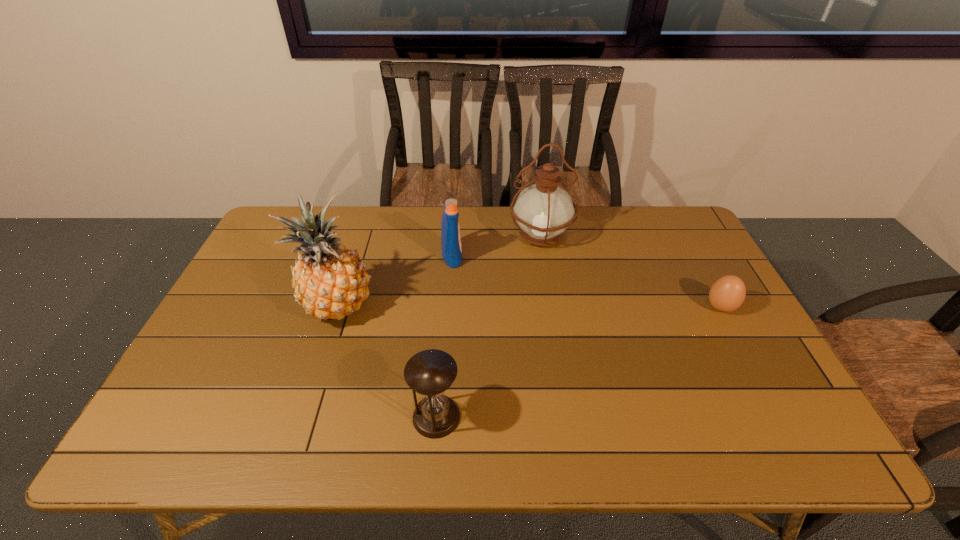
Locate an element on the screen. This screenshot has height=540, width=960. the fourth object from left to right is located at coordinates (543, 211).

Where is `pineapple`? This screenshot has height=540, width=960. pineapple is located at coordinates 330,281.

Where is `the third tallest object`? The width and height of the screenshot is (960, 540). the third tallest object is located at coordinates [451, 248].

You are a GUI agent. You are given a task and a screenshot of the screen. Output one action in this format:
    pyautogui.click(x=<x>, y=<y>)
    Task: Click on the hourglass
    This screenshot has width=960, height=540.
    Given the screenshot: What is the action you would take?
    (431, 372)

Image resolution: width=960 pixels, height=540 pixels. I want to click on the fourth tallest object, so click(431, 372).

Identify the location of the shortest object. This screenshot has height=540, width=960. (728, 293).

Locate an element on the screen. the rightmost object is located at coordinates (728, 293).

Locate an element on the screen. The width and height of the screenshot is (960, 540). vacant space located on the right of the oil lamp is located at coordinates (659, 235).

Where is `vacant space located 0.130m on the left of the leftmost object`? The image size is (960, 540). vacant space located 0.130m on the left of the leftmost object is located at coordinates (252, 306).

Image resolution: width=960 pixels, height=540 pixels. I want to click on free space located 0.190m on the label of the detergent, so click(521, 256).